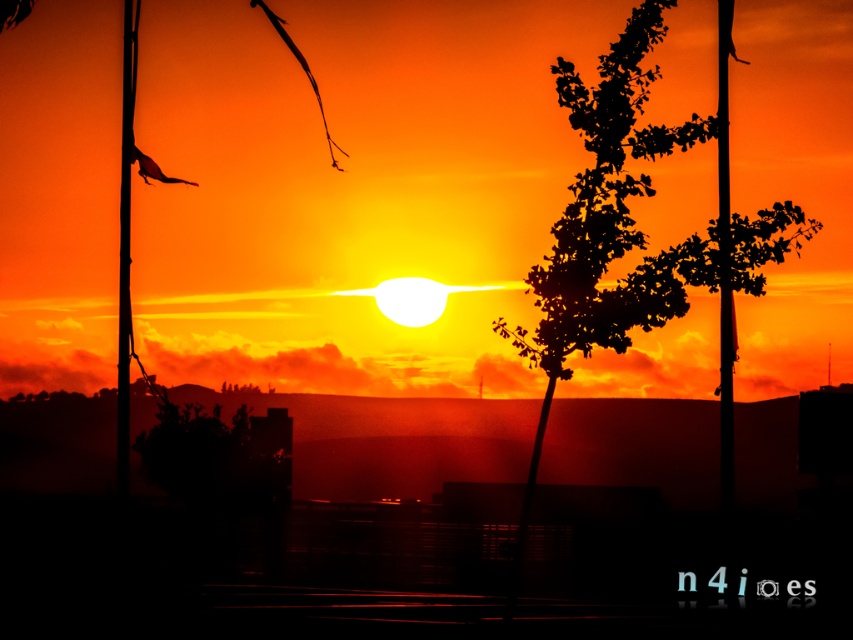
Does black matte pole at center come in front of smooth metal pole at left?

Yes, black matte pole at center is in front of smooth metal pole at left.

The image size is (853, 640). What do you see at coordinates (724, 262) in the screenshot?
I see `black matte pole at center` at bounding box center [724, 262].

Identify the location of black matte pole at center. The height and width of the screenshot is (640, 853). (724, 262).

Who is higher up, silhouette leafy tree at center or black matte pole at center?

silhouette leafy tree at center is higher up.

Between point (596, 115) and point (718, 154), which one is positioned in front?

Positioned in front is point (596, 115).

Identify the location of silhouette leafy tree at center. The height and width of the screenshot is (640, 853). (637, 230).

Is silhouette leafy tree at center smaller than smooth metal pole at left?

Correct, silhouette leafy tree at center occupies less space than smooth metal pole at left.

Which is more to the right, silhouette leafy tree at center or smooth metal pole at left?

Positioned to the right is silhouette leafy tree at center.

Is point (546, 390) less distant than point (132, 33)?

Yes.

You are a GUI agent. You are given a task and a screenshot of the screen. Output one action in this format:
    pyautogui.click(x=<x>, y=<y>)
    Task: Click on the silhouette leafy tree at center
    This screenshot has height=640, width=853.
    Given the screenshot: What is the action you would take?
    click(x=637, y=230)